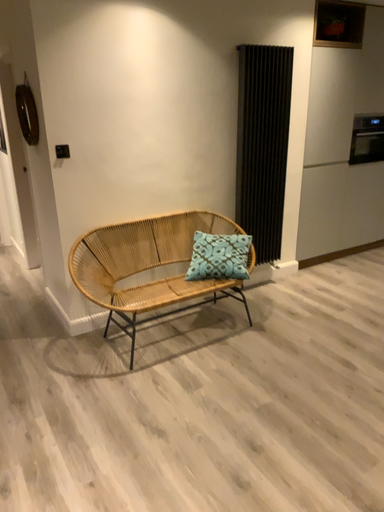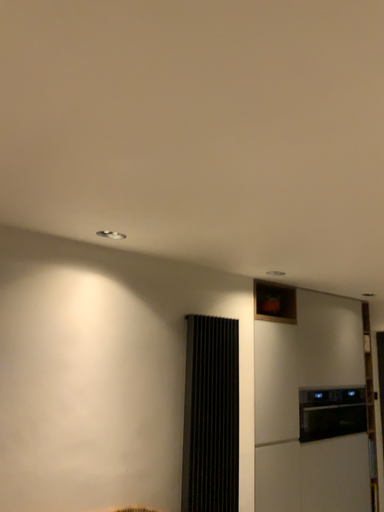
Question: Which way did the camera rotate in the video?

Choices:
 (A) rotated downward
 (B) rotated upward

Answer: (B)